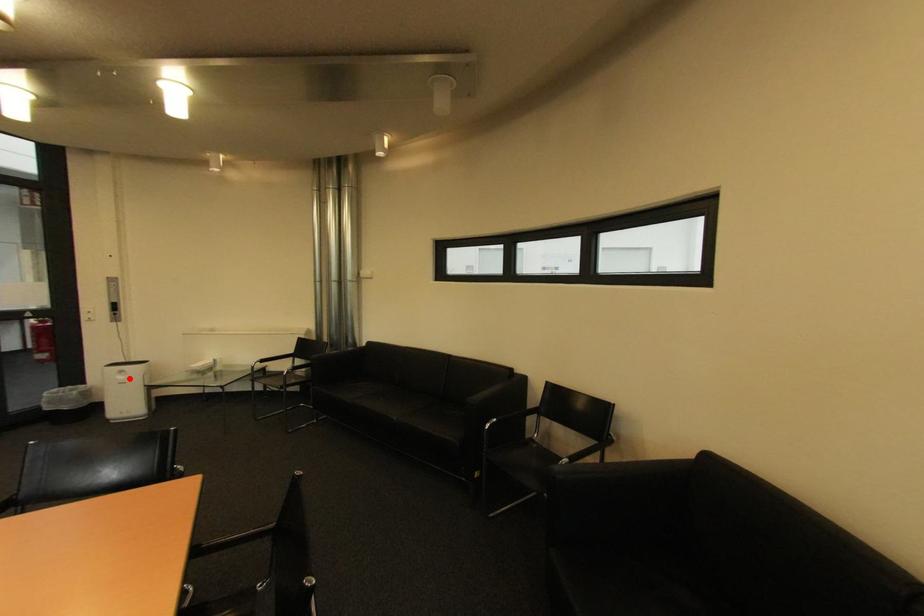
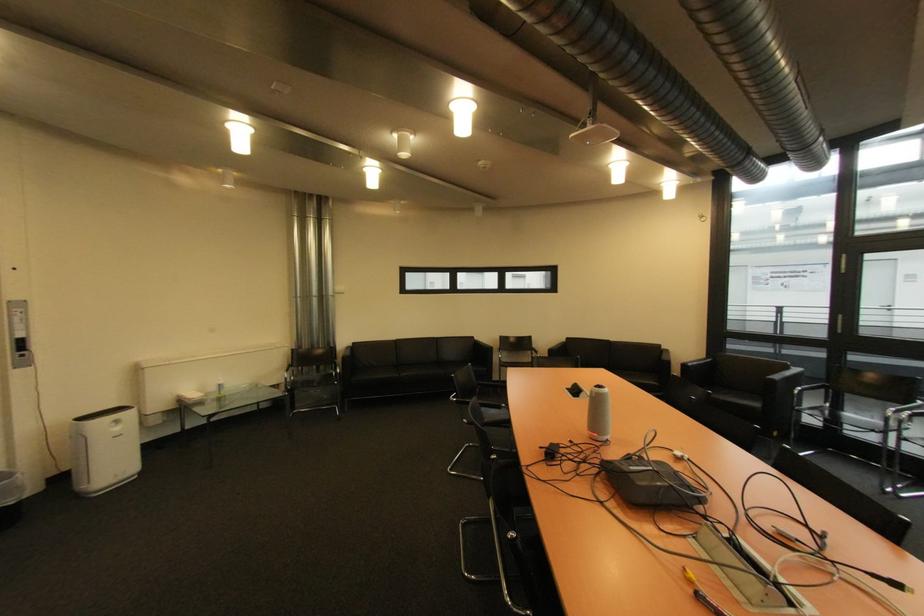
Find the pixel in the second image that matches the highlighted location in the first image.

(124, 430)